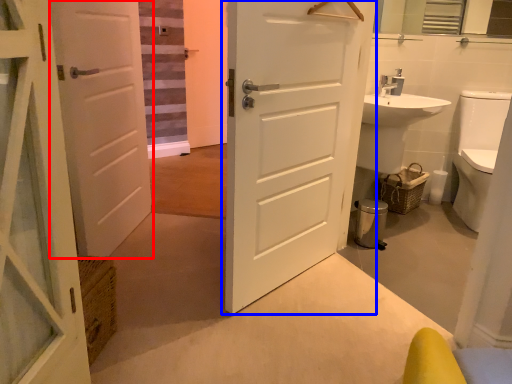
Question: Which of the following is the farthest to the observer, door (highlighted by a red box) or door (highlighted by a blue box)?

Choices:
 (A) door
 (B) door

Answer: (A)